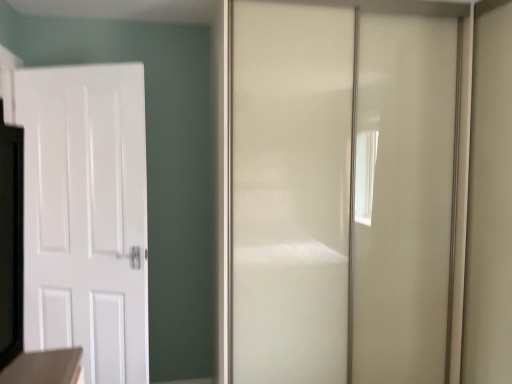
Measure the distance between glossy white door at center, placed as the second door when sorted from left to right, and camera.

2.00 meters.

Describe the element at coordinates (291, 191) in the screenshot. I see `glossy white door at center, placed as the second door when sorted from left to right` at that location.

The width and height of the screenshot is (512, 384). What are the coordinates of `glossy white door at center, the first door positioned from the right` in the screenshot? It's located at (291, 191).

This screenshot has width=512, height=384. Describe the element at coordinates (86, 216) in the screenshot. I see `white matte door at left, which ranks as the 2th door in right-to-left order` at that location.

At what (x,y) coordinates should I click in order to perform the action: click on white matte door at left, which appears as the first door when viewed from the left. Please return your answer as a coordinate pair (x, y). Looking at the image, I should click on (86, 216).

In order to click on glossy white door at center, placed as the second door when sorted from left to right in this screenshot , I will do 291,191.

Considering the relative positions of glossy white door at center, placed as the second door when sorted from left to right, and white matte door at left, which ranks as the 2th door in right-to-left order, in the image provided, is glossy white door at center, placed as the second door when sorted from left to right, to the left of white matte door at left, which ranks as the 2th door in right-to-left order, from the viewer's perspective?

In fact, glossy white door at center, placed as the second door when sorted from left to right, is to the right of white matte door at left, which ranks as the 2th door in right-to-left order.

Considering the positions of objects glossy white door at center, placed as the second door when sorted from left to right, and white matte door at left, which appears as the first door when viewed from the left, in the image provided, who is in front, glossy white door at center, placed as the second door when sorted from left to right, or white matte door at left, which appears as the first door when viewed from the left,?

glossy white door at center, placed as the second door when sorted from left to right, is in front.

Does point (387, 373) appear closer or farther from the camera than point (96, 130)?

Point (387, 373) is positioned farther from the camera compared to point (96, 130).

From the image's perspective, is glossy white door at center, the first door positioned from the right, above white matte door at left, which ranks as the 2th door in right-to-left order?

Yes.

From a real-world perspective, relative to white matte door at left, which ranks as the 2th door in right-to-left order, is glossy white door at center, placed as the second door when sorted from left to right, vertically above or below?

Clearly, from a real-world perspective, glossy white door at center, placed as the second door when sorted from left to right, is above white matte door at left, which ranks as the 2th door in right-to-left order.

Is glossy white door at center, the first door positioned from the right, wider or thinner than white matte door at left, which appears as the first door when viewed from the left?

Considering their sizes, glossy white door at center, the first door positioned from the right, looks broader than white matte door at left, which appears as the first door when viewed from the left.

Which of these two, glossy white door at center, the first door positioned from the right, or white matte door at left, which ranks as the 2th door in right-to-left order, stands shorter?

white matte door at left, which ranks as the 2th door in right-to-left order.

Is glossy white door at center, the first door positioned from the right, smaller than white matte door at left, which appears as the first door when viewed from the left?

Incorrect, glossy white door at center, the first door positioned from the right, is not smaller in size than white matte door at left, which appears as the first door when viewed from the left.

Is white matte door at left, which ranks as the 2th door in right-to-left order, a part of glossy white door at center, the first door positioned from the right?

No, white matte door at left, which ranks as the 2th door in right-to-left order, is located outside of glossy white door at center, the first door positioned from the right.

Does glossy white door at center, the first door positioned from the right, touch white matte door at left, which ranks as the 2th door in right-to-left order?

No, glossy white door at center, the first door positioned from the right, is not next to white matte door at left, which ranks as the 2th door in right-to-left order.

Is glossy white door at center, placed as the second door when sorted from left to right, looking in the opposite direction of white matte door at left, which ranks as the 2th door in right-to-left order?

No.

Image resolution: width=512 pixels, height=384 pixels. I want to click on door below the glossy white door at center, the first door positioned from the right (from a real-world perspective), so click(x=86, y=216).

Can you confirm if white matte door at left, which appears as the first door when viewed from the left, is positioned to the left of glossy white door at center, placed as the second door when sorted from left to right?

Yes, white matte door at left, which appears as the first door when viewed from the left, is to the left of glossy white door at center, placed as the second door when sorted from left to right.

In the image, is white matte door at left, which ranks as the 2th door in right-to-left order, positioned in front of or behind glossy white door at center, the first door positioned from the right?

white matte door at left, which ranks as the 2th door in right-to-left order, is behind glossy white door at center, the first door positioned from the right.

Between point (71, 129) and point (313, 196), which one is positioned behind?

The point (71, 129) is farther.

From the image's perspective, is white matte door at left, which appears as the first door when viewed from the left, located above or below glossy white door at center, placed as the second door when sorted from left to right?

From the image's perspective, white matte door at left, which appears as the first door when viewed from the left, appears below glossy white door at center, placed as the second door when sorted from left to right.

From a real-world perspective, is white matte door at left, which ranks as the 2th door in right-to-left order, under glossy white door at center, the first door positioned from the right?

Yes, from a real-world perspective, white matte door at left, which ranks as the 2th door in right-to-left order, is beneath glossy white door at center, the first door positioned from the right.

Between white matte door at left, which ranks as the 2th door in right-to-left order, and glossy white door at center, the first door positioned from the right, which one has smaller width?

white matte door at left, which ranks as the 2th door in right-to-left order.

Is white matte door at left, which ranks as the 2th door in right-to-left order, shorter than glossy white door at center, the first door positioned from the right?

Yes, white matte door at left, which ranks as the 2th door in right-to-left order, is shorter than glossy white door at center, the first door positioned from the right.

Looking at the image, does white matte door at left, which appears as the first door when viewed from the left, seem bigger or smaller compared to glossy white door at center, the first door positioned from the right?

Clearly, white matte door at left, which appears as the first door when viewed from the left, is smaller in size than glossy white door at center, the first door positioned from the right.

Is white matte door at left, which appears as the first door when viewed from the left, located outside glossy white door at center, the first door positioned from the right?

Yes.

Is white matte door at left, which appears as the first door when viewed from the left, oriented towards glossy white door at center, placed as the second door when sorted from left to right?

No, white matte door at left, which appears as the first door when viewed from the left, is not aimed at glossy white door at center, placed as the second door when sorted from left to right.

What's the angular difference between white matte door at left, which ranks as the 2th door in right-to-left order, and glossy white door at center, the first door positioned from the right,'s facing directions?

white matte door at left, which ranks as the 2th door in right-to-left order, and glossy white door at center, the first door positioned from the right, are facing 22.6 degrees away from each other.

How far apart are white matte door at left, which appears as the first door when viewed from the left, and glossy white door at center, placed as the second door when sorted from left to right?

white matte door at left, which appears as the first door when viewed from the left, and glossy white door at center, placed as the second door when sorted from left to right, are 38.55 inches apart from each other.

The width and height of the screenshot is (512, 384). I want to click on door above the white matte door at left, which appears as the first door when viewed from the left (from the image's perspective), so pos(291,191).

Where is `door on the left of glossy white door at center, the first door positioned from the right`? The height and width of the screenshot is (384, 512). door on the left of glossy white door at center, the first door positioned from the right is located at coordinates (86, 216).

The width and height of the screenshot is (512, 384). I want to click on door on the right of white matte door at left, which ranks as the 2th door in right-to-left order, so click(291, 191).